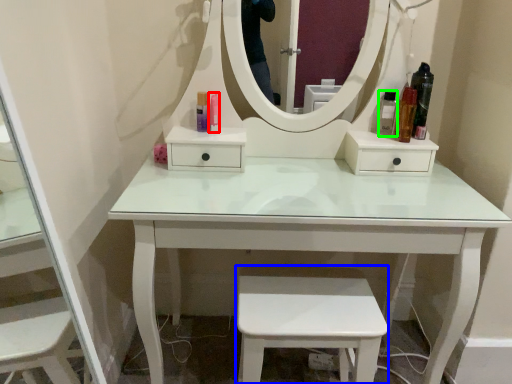
Question: Which object is positioned closest to toiletry (highlighted by a red box)? Select from step stool (highlighted by a blue box) and toiletry (highlighted by a green box).

Choices:
 (A) step stool
 (B) toiletry

Answer: (B)